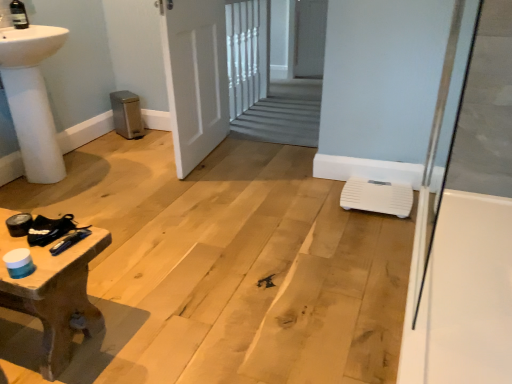
The image size is (512, 384). Identify the location of free space on the front side of white matte door at center. (195, 189).